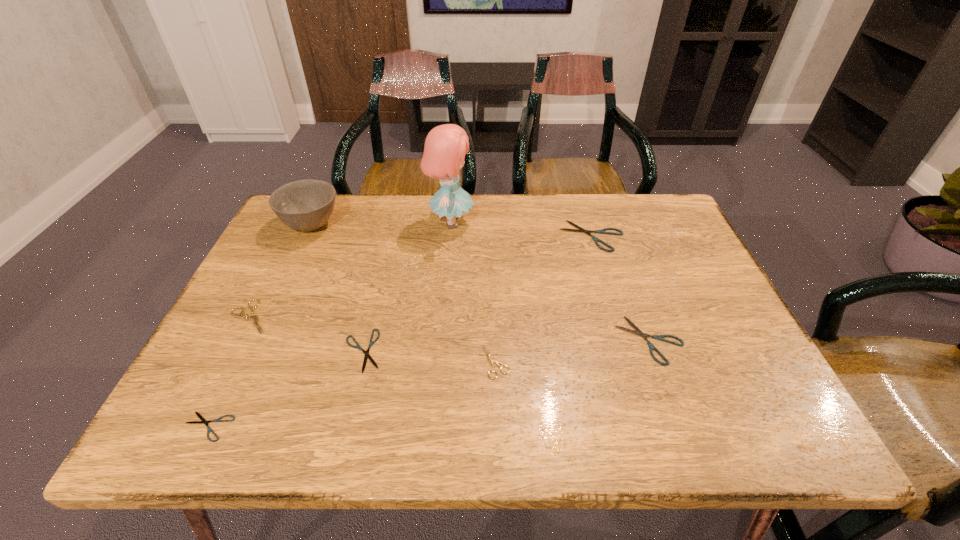
Locate which black shears is the fourth closest to the nearer beige shears. Please provide its 2D coordinates. Your answer should be formatted as a tuple, i.e. [(x, y)], where the tuple contains the x and y coordinates of a point satisfying the conditions above.

[(203, 420)]

Where is `the third closest black shears to the farther beige shears`? This screenshot has height=540, width=960. the third closest black shears to the farther beige shears is located at coordinates (602, 231).

Locate an element on the screen. This screenshot has width=960, height=540. free location that satisfies the following two spatial constraints: 1. on the front-facing side of the doll; 2. on the front side of the second tallest object is located at coordinates (451, 225).